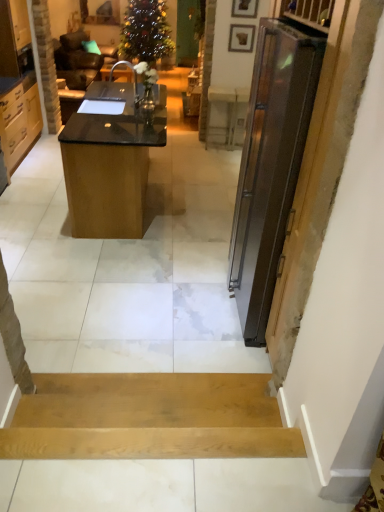
Measure the distance between wooden picture frame at upper center, which ranks as the second picture frame in top-to-bottom order, and camera.

wooden picture frame at upper center, which ranks as the second picture frame in top-to-bottom order, and camera are 5.51 meters apart.

Where is `light brown wood drawers at left, the first cabinetry in the top-to-bottom sequence`? The height and width of the screenshot is (512, 384). light brown wood drawers at left, the first cabinetry in the top-to-bottom sequence is located at coordinates (18, 83).

What do you see at coordinates (245, 8) in the screenshot? Image resolution: width=384 pixels, height=512 pixels. I see `wooden picture frame at upper center, which is the first picture frame in top-to-bottom order` at bounding box center [245, 8].

This screenshot has height=512, width=384. What are the coordinates of `black glossy desk at center` in the screenshot? It's located at (110, 161).

Is wooden picture frame at upper center, which is the first picture frame in top-to-bottom order, in front of light brown wood drawers at left, the first cabinetry in the top-to-bottom sequence?

No, wooden picture frame at upper center, which is the first picture frame in top-to-bottom order, is further to the viewer.

What's the angular difference between wooden picture frame at upper center, the 2th picture frame viewed from the back, and light brown wood drawers at left, the first cabinetry in the top-to-bottom sequence,'s facing directions?

93.1 degrees.

Would you say wooden picture frame at upper center, which is the first picture frame in top-to-bottom order, is to the left or to the right of light brown wood drawers at left, the first cabinetry in the top-to-bottom sequence, in the picture?

wooden picture frame at upper center, which is the first picture frame in top-to-bottom order, is positioned on light brown wood drawers at left, the first cabinetry in the top-to-bottom sequence,'s right side.

Is wooden picture frame at upper center, the 1th picture frame viewed from the front, in contact with light brown wood drawers at left, the first cabinetry in the top-to-bottom sequence?

No, wooden picture frame at upper center, the 1th picture frame viewed from the front, is not making contact with light brown wood drawers at left, the first cabinetry in the top-to-bottom sequence.

How much distance is there between black glossy desk at center and light brown wood drawers at left, the first cabinetry in the top-to-bottom sequence?

A distance of 5.19 feet exists between black glossy desk at center and light brown wood drawers at left, the first cabinetry in the top-to-bottom sequence.

What's the angular difference between black glossy desk at center and light brown wood drawers at left, the 2th cabinetry ordered from the bottom,'s facing directions?

There is a 0.128-degree angle between the facing directions of black glossy desk at center and light brown wood drawers at left, the 2th cabinetry ordered from the bottom.

Based on the photo, is light brown wood drawers at left, the 2th cabinetry ordered from the bottom, surrounded by black glossy desk at center?

No, black glossy desk at center does not contain light brown wood drawers at left, the 2th cabinetry ordered from the bottom.

Does black glossy desk at center turn towards light brown wood drawers at left, the first cabinetry in the top-to-bottom sequence?

No.

Looking at their sizes, would you say black glossy desk at center is wider or thinner than light wood cabinet at left, placed as the first cabinetry when sorted from bottom to top?

Clearly, black glossy desk at center has more width compared to light wood cabinet at left, placed as the first cabinetry when sorted from bottom to top.

In order to click on cabinetry that is the 1st one above the black glossy desk at center (from a real-world perspective) in this screenshot , I will do pyautogui.click(x=19, y=117).

Is black glossy desk at center aimed at light wood cabinet at left, placed as the first cabinetry when sorted from bottom to top?

No, black glossy desk at center is not turned towards light wood cabinet at left, placed as the first cabinetry when sorted from bottom to top.

From a real-world perspective, is black glossy desk at center physically located above or below light wood cabinet at left, placed as the first cabinetry when sorted from bottom to top?

black glossy desk at center is situated lower than light wood cabinet at left, placed as the first cabinetry when sorted from bottom to top, in the real world.

Is light brown wood drawers at left, the 2th cabinetry ordered from the bottom, not near black glossy desk at center?

Yes, light brown wood drawers at left, the 2th cabinetry ordered from the bottom, and black glossy desk at center are located far from each other.

Is light brown wood drawers at left, the first cabinetry in the top-to-bottom sequence, positioned beyond the bounds of black glossy desk at center?

That's correct, light brown wood drawers at left, the first cabinetry in the top-to-bottom sequence, is outside of black glossy desk at center.

In terms of height, does light brown wood drawers at left, the 2th cabinetry ordered from the bottom, look taller or shorter compared to black glossy desk at center?

In the image, light brown wood drawers at left, the 2th cabinetry ordered from the bottom, appears to be taller than black glossy desk at center.

Is light brown wood drawers at left, the 2th cabinetry ordered from the bottom, aimed at black glossy desk at center?

No, light brown wood drawers at left, the 2th cabinetry ordered from the bottom, is not facing towards black glossy desk at center.

From the picture: Which of these two, wooden picture frame at upper center, the 1th picture frame from the back, or light wood cabinet at left, the second cabinetry when ordered from top to bottom, is bigger?

light wood cabinet at left, the second cabinetry when ordered from top to bottom.

Relative to light wood cabinet at left, the second cabinetry when ordered from top to bottom, is wooden picture frame at upper center, the 1th picture frame ordered from the bottom, in front or behind?

Visually, wooden picture frame at upper center, the 1th picture frame ordered from the bottom, is located behind light wood cabinet at left, the second cabinetry when ordered from top to bottom.

What's the angular difference between wooden picture frame at upper center, which ranks as the second picture frame in top-to-bottom order, and light wood cabinet at left, the second cabinetry when ordered from top to bottom,'s facing directions?

They differ by 93.1 degrees in their facing directions.

Image resolution: width=384 pixels, height=512 pixels. There is a wooden picture frame at upper center, which ranks as the second picture frame in top-to-bottom order. Find the location of `the 2nd cabinetry below it (from the image's perspective)`. the 2nd cabinetry below it (from the image's perspective) is located at coordinates (19, 117).

Can you confirm if black glossy desk at center is positioned to the left of wooden picture frame at upper center, which is the first picture frame in top-to-bottom order?

Yes.

Is black glossy desk at center completely or partially outside of wooden picture frame at upper center, the 2th picture frame viewed from the back?

Yes, black glossy desk at center is not within wooden picture frame at upper center, the 2th picture frame viewed from the back.

Are black glossy desk at center and wooden picture frame at upper center, which is the first picture frame in top-to-bottom order, located far from each other?

Yes, black glossy desk at center and wooden picture frame at upper center, which is the first picture frame in top-to-bottom order, are located far from each other.

From the image's perspective, is black glossy desk at center located beneath wooden picture frame at upper center, the 2th picture frame viewed from the back?

Indeed, from the image's perspective, black glossy desk at center is shown beneath wooden picture frame at upper center, the 2th picture frame viewed from the back.

Does light wood cabinet at left, the second cabinetry when ordered from top to bottom, have a lesser height compared to wooden picture frame at upper center, the 1th picture frame viewed from the front?

No.

Could you tell me if light wood cabinet at left, the second cabinetry when ordered from top to bottom, is turned towards wooden picture frame at upper center, the 1th picture frame viewed from the front?

Yes, light wood cabinet at left, the second cabinetry when ordered from top to bottom, faces towards wooden picture frame at upper center, the 1th picture frame viewed from the front.

Are light wood cabinet at left, placed as the first cabinetry when sorted from bottom to top, and wooden picture frame at upper center, the 1th picture frame viewed from the front, located far from each other?

light wood cabinet at left, placed as the first cabinetry when sorted from bottom to top, is far away from wooden picture frame at upper center, the 1th picture frame viewed from the front.

The width and height of the screenshot is (384, 512). What are the coordinates of `the 2nd cabinetry to the left when counting from the wooden picture frame at upper center, positioned as the 2th picture frame in bottom-to-top order` in the screenshot? It's located at (18, 83).

From the image's perspective, which cabinetry is the 2nd one above the black glossy desk at center? Please provide its 2D coordinates.

[(18, 83)]

Estimate the real-world distances between objects in this image. Which object is closer to black glossy desk at center, wooden picture frame at upper center, which is the first picture frame in top-to-bottom order, or wooden picture frame at upper center, which is counted as the second picture frame, starting from the front?

Based on the image, wooden picture frame at upper center, which is counted as the second picture frame, starting from the front, appears to be nearer to black glossy desk at center.

Looking at the image, which one is located further to light brown wood drawers at left, the 2th cabinetry ordered from the bottom, black glossy desk at center or wooden picture frame at upper center, the 1th picture frame from the back?

Based on the image, wooden picture frame at upper center, the 1th picture frame from the back, appears to be further to light brown wood drawers at left, the 2th cabinetry ordered from the bottom.

Looking at the image, which one is located further to black glossy desk at center, wooden picture frame at upper center, the 1th picture frame ordered from the bottom, or light wood cabinet at left, the second cabinetry when ordered from top to bottom?

Based on the image, wooden picture frame at upper center, the 1th picture frame ordered from the bottom, appears to be further to black glossy desk at center.

Which object lies further to the anchor point wooden picture frame at upper center, the 1th picture frame from the back, wooden picture frame at upper center, the 1th picture frame viewed from the front, or black glossy desk at center?

black glossy desk at center lies further to wooden picture frame at upper center, the 1th picture frame from the back, than the other object.

Considering their positions, is wooden picture frame at upper center, which is counted as the second picture frame, starting from the front, positioned further to wooden picture frame at upper center, the 2th picture frame viewed from the back, than black glossy desk at center?

black glossy desk at center is positioned further to the anchor wooden picture frame at upper center, the 2th picture frame viewed from the back.

Looking at the image, which one is located further to wooden picture frame at upper center, the 1th picture frame ordered from the bottom, light wood cabinet at left, placed as the first cabinetry when sorted from bottom to top, or wooden picture frame at upper center, which is the first picture frame in top-to-bottom order?

light wood cabinet at left, placed as the first cabinetry when sorted from bottom to top, lies further to wooden picture frame at upper center, the 1th picture frame ordered from the bottom, than the other object.

Estimate the real-world distances between objects in this image. Which object is closer to black glossy desk at center, light wood cabinet at left, placed as the first cabinetry when sorted from bottom to top, or light brown wood drawers at left, the first cabinetry in the top-to-bottom sequence?

light wood cabinet at left, placed as the first cabinetry when sorted from bottom to top, is closer to black glossy desk at center.

Considering their positions, is black glossy desk at center positioned further to light wood cabinet at left, the second cabinetry when ordered from top to bottom, than wooden picture frame at upper center, the 1th picture frame ordered from the bottom?

wooden picture frame at upper center, the 1th picture frame ordered from the bottom.

Identify the location of desk between light wood cabinet at left, the second cabinetry when ordered from top to bottom, and wooden picture frame at upper center, the 2th picture frame viewed from the back, from left to right. (110, 161).

Locate an element on the screen. Image resolution: width=384 pixels, height=512 pixels. desk between light wood cabinet at left, the second cabinetry when ordered from top to bottom, and wooden picture frame at upper center, which is counted as the second picture frame, starting from the front, from left to right is located at coordinates (110, 161).

Identify the location of picture frame between light brown wood drawers at left, the 2th cabinetry ordered from the bottom, and wooden picture frame at upper center, the 2th picture frame viewed from the back, in the horizontal direction. The height and width of the screenshot is (512, 384). (241, 38).

At what (x,y) coordinates should I click in order to perform the action: click on picture frame between light wood cabinet at left, the second cabinetry when ordered from top to bottom, and wooden picture frame at upper center, which is the first picture frame in top-to-bottom order, in the horizontal direction. Please return your answer as a coordinate pair (x, y). This screenshot has width=384, height=512. Looking at the image, I should click on (241, 38).